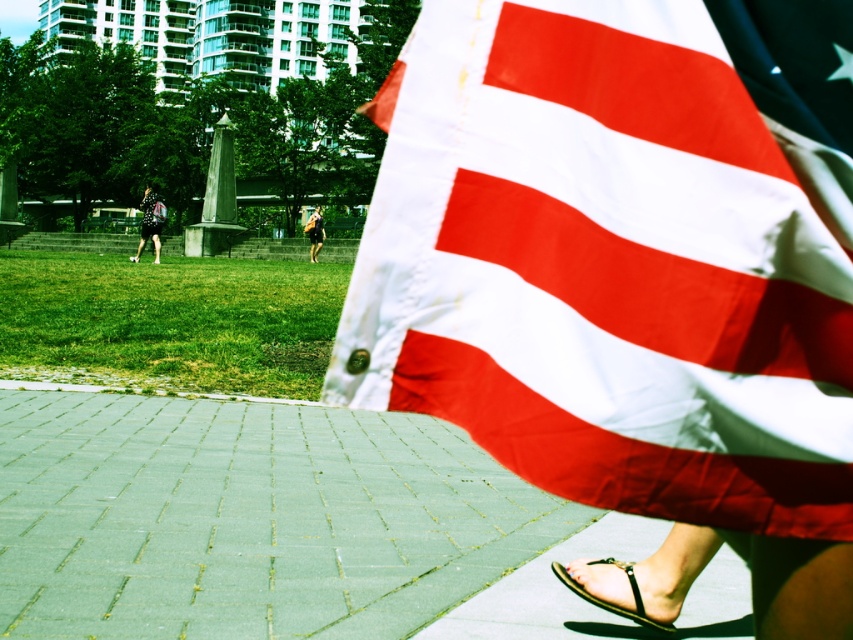
Question: Among these points, which one is nearest to the camera?

Choices:
 (A) tap(585, 595)
 (B) tap(310, 237)

Answer: (A)

Question: Can you confirm if dark blue jeans at lower left is positioned above camouflage-patterned backpack at center?

Choices:
 (A) no
 (B) yes

Answer: (B)

Question: Which of the following is the closest to the observer?

Choices:
 (A) (152, 240)
 (B) (647, 625)
 (C) (316, 252)

Answer: (B)

Question: Is dark blue jeans at lower left wider than camouflage-patterned backpack at center?

Choices:
 (A) no
 (B) yes

Answer: (B)

Question: Which of the following is the farthest from the observer?

Choices:
 (A) dark blue jeans at lower left
 (B) black fabric sandal at lower right
 (C) red and white striped fabric at right

Answer: (A)

Question: Is dark blue jeans at lower left to the right of camouflage-patterned backpack at center from the viewer's perspective?

Choices:
 (A) yes
 (B) no

Answer: (B)